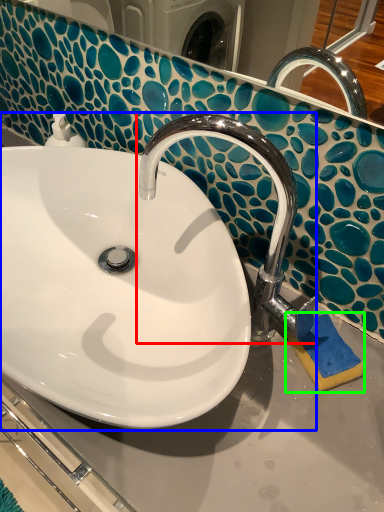
Question: Which is nearer to the tap (highlighted by a red box)? sink (highlighted by a blue box) or soap (highlighted by a green box).

Choices:
 (A) sink
 (B) soap

Answer: (A)